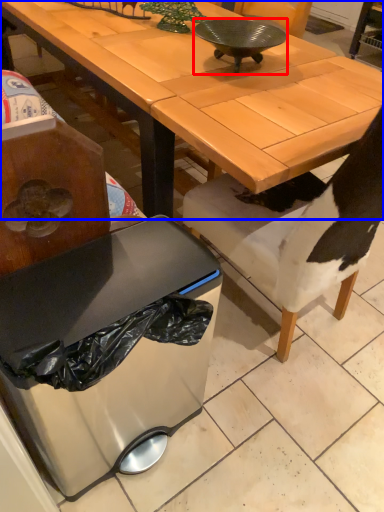
Question: Which object appears closest to the camera in this image, bowl (highlighted by a red box) or desk (highlighted by a blue box)?

Choices:
 (A) bowl
 (B) desk

Answer: (B)